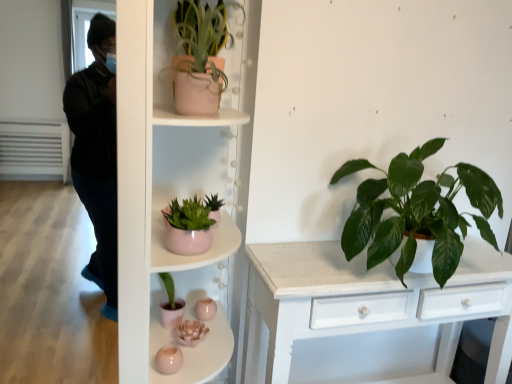
Where is `green glossy leafy plant at right, which is the 1th houseplant from bottom to top`? The height and width of the screenshot is (384, 512). green glossy leafy plant at right, which is the 1th houseplant from bottom to top is located at coordinates (419, 213).

Based on their sizes in the image, would you say matte pink pot at center, which ranks as the 1th shelf in bottom-to-top order, is bigger or smaller than matte pink pot at upper center, which is the 2th houseplant from bottom to top?

Clearly, matte pink pot at center, which ranks as the 1th shelf in bottom-to-top order, is larger in size than matte pink pot at upper center, which is the 2th houseplant from bottom to top.

Is matte pink pot at center, which ranks as the 1th shelf in bottom-to-top order, shorter than matte pink pot at upper center, which appears as the 1th houseplant when viewed from the left?

No, matte pink pot at center, which ranks as the 1th shelf in bottom-to-top order, is not shorter than matte pink pot at upper center, which appears as the 1th houseplant when viewed from the left.

From a real-world perspective, between matte pink pot at center, the 2th shelf positioned from the top, and matte pink pot at upper center, which is the 2th houseplant from bottom to top, who is vertically lower?

matte pink pot at center, the 2th shelf positioned from the top, is physically lower.

Is matte pink pot at center, which ranks as the 1th shelf in bottom-to-top order, not near matte pink pot at upper center, which is the 2th houseplant from bottom to top?

No, there isn't a large distance between matte pink pot at center, which ranks as the 1th shelf in bottom-to-top order, and matte pink pot at upper center, which is the 2th houseplant from bottom to top.

Identify the location of the 2nd shelf positioned below the green glossy leafy plant at right, placed as the 2th houseplant when sorted from top to bottom (from a real-world perspective). [139, 179].

What's the angular difference between matte pink pot at center, the 2th shelf positioned from the top, and green glossy leafy plant at right, which is counted as the 2th houseplant, starting from the left,'s facing directions?

The facing directions of matte pink pot at center, the 2th shelf positioned from the top, and green glossy leafy plant at right, which is counted as the 2th houseplant, starting from the left, are 0.0898 degrees apart.

Would you say matte pink pot at center, which ranks as the 1th shelf in bottom-to-top order, is to the left or to the right of green glossy leafy plant at right, which is the 1th houseplant from bottom to top, in the picture?

matte pink pot at center, which ranks as the 1th shelf in bottom-to-top order, is positioned on green glossy leafy plant at right, which is the 1th houseplant from bottom to top,'s left side.

From the image's perspective, is matte pink pot at center, which ranks as the 1th shelf in bottom-to-top order, below green glossy leafy plant at right, which is the 1th houseplant from bottom to top?

Yes, from the image's perspective, matte pink pot at center, which ranks as the 1th shelf in bottom-to-top order, is below green glossy leafy plant at right, which is the 1th houseplant from bottom to top.

In the scene shown: From a real-world perspective, is matte pink pot at center, the 2th shelf ordered from the bottom, located beneath green glossy leafy plant at right, the 1th houseplant in the right-to-left sequence?

Yes.

Is there a large distance between matte pink pot at center, which ranks as the first shelf in top-to-bottom order, and green glossy leafy plant at right, the 1th houseplant in the right-to-left sequence?

No, matte pink pot at center, which ranks as the first shelf in top-to-bottom order, is not far from green glossy leafy plant at right, the 1th houseplant in the right-to-left sequence.

Is matte pink pot at center, the 2th shelf ordered from the bottom, spatially inside green glossy leafy plant at right, placed as the 2th houseplant when sorted from top to bottom, or outside of it?

matte pink pot at center, the 2th shelf ordered from the bottom, is not inside green glossy leafy plant at right, placed as the 2th houseplant when sorted from top to bottom, it's outside.

Image resolution: width=512 pixels, height=384 pixels. In order to click on shelf that is the 1st one when counting leftward from the matte pink pot at upper center, which is the 2th houseplant from bottom to top in this screenshot , I will do `click(139, 179)`.

From the image's perspective, does matte pink pot at upper center, which appears as the 1th houseplant when viewed from the left, appear higher than matte pink pot at center, the 2th shelf positioned from the top?

Yes, from the image's perspective, matte pink pot at upper center, which appears as the 1th houseplant when viewed from the left, is above matte pink pot at center, the 2th shelf positioned from the top.

Is matte pink pot at upper center, which is the 2th houseplant from bottom to top, inside or outside of matte pink pot at center, the 2th shelf positioned from the top?

matte pink pot at upper center, which is the 2th houseplant from bottom to top, fits inside matte pink pot at center, the 2th shelf positioned from the top.

Considering the sizes of objects green glossy leafy plant at right, the 1th houseplant in the right-to-left sequence, and matte pink pot at upper center, which is the 2th houseplant from bottom to top, in the image provided, who is shorter, green glossy leafy plant at right, the 1th houseplant in the right-to-left sequence, or matte pink pot at upper center, which is the 2th houseplant from bottom to top,?

Standing shorter between the two is matte pink pot at upper center, which is the 2th houseplant from bottom to top.

Which is nearer, (369, 181) or (217, 99)?

The point (217, 99) is closer to the camera.

From a real-world perspective, between green glossy leafy plant at right, which is counted as the 2th houseplant, starting from the left, and matte pink pot at upper center, which appears as the 1th houseplant when viewed from the left, who is vertically higher?

matte pink pot at upper center, which appears as the 1th houseplant when viewed from the left, from a real-world perspective.

Is matte pink pot at center, which ranks as the first shelf in top-to-bottom order, thinner than matte pink pot at upper center, which appears as the 1th houseplant when viewed from the left?

Indeed, matte pink pot at center, which ranks as the first shelf in top-to-bottom order, has a lesser width compared to matte pink pot at upper center, which appears as the 1th houseplant when viewed from the left.

From the image's perspective, is matte pink pot at center, the 2th shelf ordered from the bottom, below matte pink pot at upper center, which appears as the 1th houseplant when viewed from the left?

Yes, from the image's perspective, matte pink pot at center, the 2th shelf ordered from the bottom, is beneath matte pink pot at upper center, which appears as the 1th houseplant when viewed from the left.

How many degrees apart are the facing directions of matte pink pot at center, the 2th shelf ordered from the bottom, and matte pink pot at upper center, the 1th houseplant viewed from the top?

There is a 11.9-degree angle between the facing directions of matte pink pot at center, the 2th shelf ordered from the bottom, and matte pink pot at upper center, the 1th houseplant viewed from the top.

Based on their positions, is matte pink pot at center, which ranks as the first shelf in top-to-bottom order, located to the left or right of matte pink pot at upper center, marked as the second houseplant in a right-to-left arrangement?

Based on their positions, matte pink pot at center, which ranks as the first shelf in top-to-bottom order, is located to the left of matte pink pot at upper center, marked as the second houseplant in a right-to-left arrangement.

What are the coordinates of `houseplant that appears below the matte pink pot at upper center, which is the 2th houseplant from bottom to top (from a real-world perspective)` in the screenshot? It's located at (419, 213).

Is green glossy leafy plant at right, which is the 1th houseplant from bottom to top, at the back of matte pink pot at upper center, which is the 2th houseplant from bottom to top?

matte pink pot at upper center, which is the 2th houseplant from bottom to top, does not have its back to green glossy leafy plant at right, which is the 1th houseplant from bottom to top.

In the scene shown: Is matte pink pot at upper center, marked as the second houseplant in a right-to-left arrangement, outside of green glossy leafy plant at right, placed as the 2th houseplant when sorted from top to bottom?

Yes.

Locate an element on the screen. The width and height of the screenshot is (512, 384). shelf that is the 2nd object located in front of the matte pink pot at upper center, which appears as the 1th houseplant when viewed from the left is located at coordinates (139, 179).

This screenshot has width=512, height=384. Find the location of `the 2nd houseplant to the right when counting from the matte pink pot at center, the 2th shelf positioned from the top`. the 2nd houseplant to the right when counting from the matte pink pot at center, the 2th shelf positioned from the top is located at coordinates (419, 213).

From the image, which object appears to be nearer to matte pink pot at center, the 2th shelf ordered from the bottom, matte pink pot at upper center, marked as the second houseplant in a right-to-left arrangement, or green glossy leafy plant at right, the 1th houseplant in the right-to-left sequence?

The object closer to matte pink pot at center, the 2th shelf ordered from the bottom, is matte pink pot at upper center, marked as the second houseplant in a right-to-left arrangement.

Estimate the real-world distances between objects in this image. Which object is closer to matte pink pot at center, which ranks as the first shelf in top-to-bottom order, green glossy leafy plant at right, which is counted as the 2th houseplant, starting from the left, or matte pink pot at upper center, marked as the second houseplant in a right-to-left arrangement?

Among the two, matte pink pot at upper center, marked as the second houseplant in a right-to-left arrangement, is located nearer to matte pink pot at center, which ranks as the first shelf in top-to-bottom order.

Estimate the real-world distances between objects in this image. Which object is further from matte pink pot at center, the 2th shelf positioned from the top, green glossy leafy plant at right, which is counted as the 2th houseplant, starting from the left, or matte pink pot at upper center, which appears as the 1th houseplant when viewed from the left?

green glossy leafy plant at right, which is counted as the 2th houseplant, starting from the left, is positioned further to the anchor matte pink pot at center, the 2th shelf positioned from the top.

When comparing their distances from matte pink pot at upper center, marked as the second houseplant in a right-to-left arrangement, does green glossy leafy plant at right, which is the 1th houseplant from bottom to top, or matte pink pot at center, which ranks as the 1th shelf in bottom-to-top order, seem closer?

The object closer to matte pink pot at upper center, marked as the second houseplant in a right-to-left arrangement, is matte pink pot at center, which ranks as the 1th shelf in bottom-to-top order.

Consider the image. Based on their spatial positions, is green glossy leafy plant at right, which is counted as the 2th houseplant, starting from the left, or matte pink pot at center, which ranks as the first shelf in top-to-bottom order, further from matte pink pot at center, which ranks as the 1th shelf in bottom-to-top order?

green glossy leafy plant at right, which is counted as the 2th houseplant, starting from the left, is further to matte pink pot at center, which ranks as the 1th shelf in bottom-to-top order.

From the image, which object appears to be farther from matte pink pot at center, which ranks as the 1th shelf in bottom-to-top order, matte pink pot at upper center, the 1th houseplant viewed from the top, or green glossy leafy plant at right, the 1th houseplant in the right-to-left sequence?

green glossy leafy plant at right, the 1th houseplant in the right-to-left sequence, lies further to matte pink pot at center, which ranks as the 1th shelf in bottom-to-top order, than the other object.

From the image, which object appears to be nearer to matte pink pot at center, which ranks as the 1th shelf in bottom-to-top order, matte pink pot at center, which ranks as the first shelf in top-to-bottom order, or matte pink pot at upper center, which is the 2th houseplant from bottom to top?

Based on the image, matte pink pot at center, which ranks as the first shelf in top-to-bottom order, appears to be nearer to matte pink pot at center, which ranks as the 1th shelf in bottom-to-top order.

Which object lies nearer to the anchor point matte pink pot at upper center, the 1th houseplant viewed from the top, matte pink pot at center, the 2th shelf ordered from the bottom, or green glossy leafy plant at right, which is counted as the 2th houseplant, starting from the left?

Based on the image, matte pink pot at center, the 2th shelf ordered from the bottom, appears to be nearer to matte pink pot at upper center, the 1th houseplant viewed from the top.

This screenshot has width=512, height=384. Identify the location of houseplant located between matte pink pot at center, which ranks as the first shelf in top-to-bottom order, and green glossy leafy plant at right, which is the 1th houseplant from bottom to top, in the left-right direction. (199, 58).

Locate an element on the screen. This screenshot has width=512, height=384. shelf between matte pink pot at upper center, the 1th houseplant viewed from the top, and matte pink pot at center, which ranks as the 1th shelf in bottom-to-top order, in the vertical direction is located at coordinates (194, 255).

The image size is (512, 384). I want to click on shelf between matte pink pot at center, which ranks as the first shelf in top-to-bottom order, and green glossy leafy plant at right, the 1th houseplant in the right-to-left sequence, from left to right, so (139, 179).

Locate an element on the screen. The width and height of the screenshot is (512, 384). houseplant situated between matte pink pot at center, the 2th shelf positioned from the top, and green glossy leafy plant at right, which is the 1th houseplant from bottom to top, from left to right is located at coordinates (199, 58).